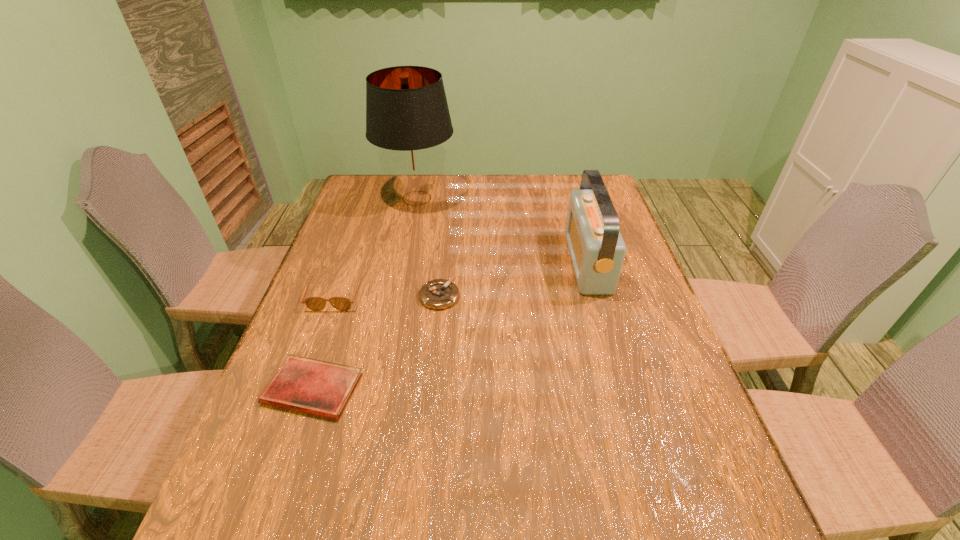
Locate an element on the screen. Image resolution: width=960 pixels, height=540 pixels. object located at the far left corner is located at coordinates (407, 115).

In the image, there is a desktop. Where is `vacant area at the far edge`? This screenshot has width=960, height=540. vacant area at the far edge is located at coordinates (434, 198).

In the image, there is a desktop. At what (x,y) coordinates should I click in order to perform the action: click on vacant area at the left edge. Please return your answer as a coordinate pair (x, y). Looking at the image, I should click on (302, 305).

The width and height of the screenshot is (960, 540). Find the location of `free space at the right edge of the desktop`. free space at the right edge of the desktop is located at coordinates pos(612,301).

Identify the location of vacant space at the far left corner of the desktop. The width and height of the screenshot is (960, 540). (380, 183).

This screenshot has width=960, height=540. Identify the location of vacant region at the near left corner of the desktop. (209, 531).

Where is `free space at the near right corner of the desktop`? The width and height of the screenshot is (960, 540). free space at the near right corner of the desktop is located at coordinates (742, 538).

At what (x,y) coordinates should I click in order to perform the action: click on unoccupied position between the diary and the radio receiver. Please return your answer as a coordinate pair (x, y). This screenshot has width=960, height=540. Looking at the image, I should click on click(450, 326).

At what (x,y) coordinates should I click in order to perform the action: click on free area in between the sunglasses and the shortest object. Please return your answer as a coordinate pair (x, y). This screenshot has height=540, width=960. Looking at the image, I should click on (324, 341).

Identify the location of free space between the farthest object and the sunglasses. (376, 246).